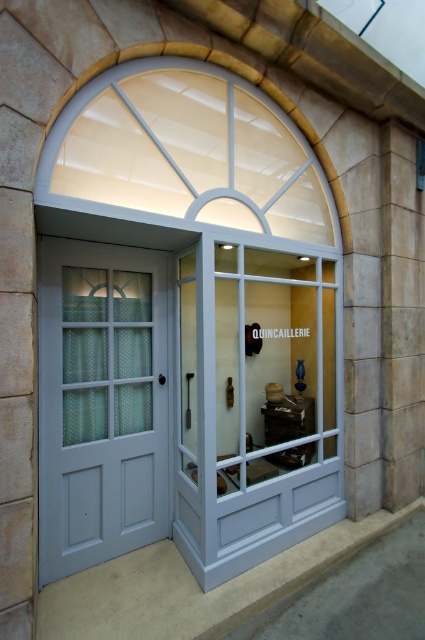
How far apart are matte gray door at center and white glass window at upper center?

matte gray door at center is 98.09 centimeters away from white glass window at upper center.

Looking at this image, is matte gray door at center shorter than white glass window at upper center?

No.

Who is more forward, (x=130, y=532) or (x=215, y=116)?

Point (x=215, y=116) is more forward.

Find the location of a particular element. matte gray door at center is located at coordinates (101, 403).

Between clear glass door at center and matte gray door at center, which one appears on the right side from the viewer's perspective?

Positioned to the right is clear glass door at center.

Between point (195, 442) and point (51, 276), which one is positioned in front?

Positioned in front is point (51, 276).

Find the location of a particular element. The height and width of the screenshot is (640, 425). clear glass door at center is located at coordinates click(255, 403).

You are a GUI agent. You are given a task and a screenshot of the screen. Output one action in this format:
    pyautogui.click(x=<x>, y=<y>)
    Task: Click on the clear glass door at center
    This screenshot has height=640, width=425.
    Given the screenshot: What is the action you would take?
    pyautogui.click(x=255, y=403)

Which is below, clear glass door at center or white glass window at upper center?

Positioned lower is clear glass door at center.

Can you confirm if clear glass door at center is positioned above white glass window at upper center?

No, clear glass door at center is not above white glass window at upper center.

Does point (254, 340) come farther from viewer compared to point (172, 64)?

Yes, point (254, 340) is farther from viewer.

At what (x,y) coordinates should I click in order to perform the action: click on clear glass door at center. Please return your answer as a coordinate pair (x, y). Looking at the image, I should click on (255, 403).